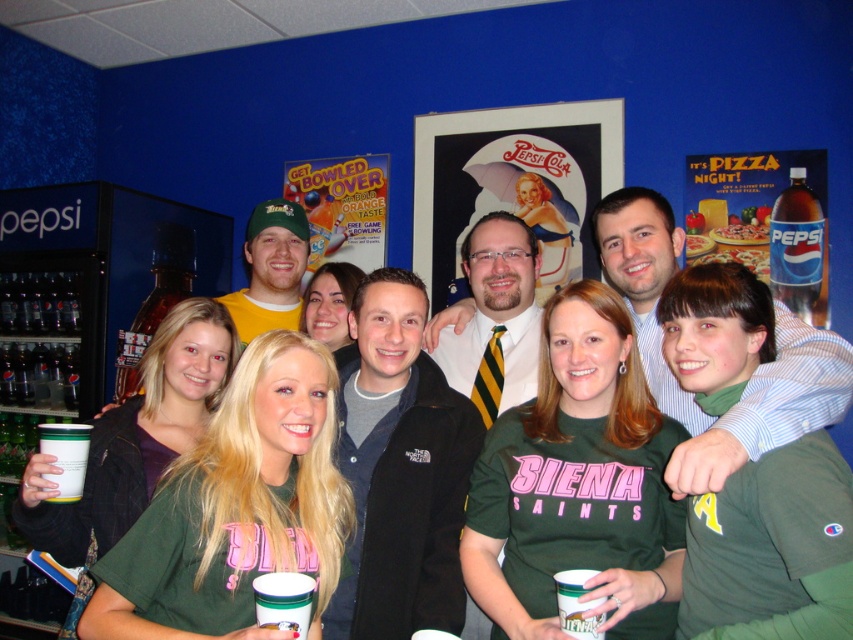
Question: Where is yellow t-shirt at center located in relation to white paper cup at lower left in the image?

Choices:
 (A) below
 (B) above

Answer: (B)

Question: Is white shirt at center smaller than clear glass bottle at left?

Choices:
 (A) no
 (B) yes

Answer: (A)

Question: Among these objects, which one is farthest from the camera?

Choices:
 (A) translucent plastic cup at lower left
 (B) striped tie at center
 (C) yellow t-shirt at center

Answer: (A)

Question: Is black fleece jacket at center wider than translucent plastic cup at lower left?

Choices:
 (A) no
 (B) yes

Answer: (A)

Question: Based on their relative distances, which object is nearer to the black fleece jacket at center?

Choices:
 (A) white paper cup at lower left
 (B) striped tie at center
 (C) translucent plastic bottle at upper right

Answer: (B)

Question: Among these objects, which one is nearest to the camera?

Choices:
 (A) white paper cup at lower left
 (B) clear glass bottle at left

Answer: (A)